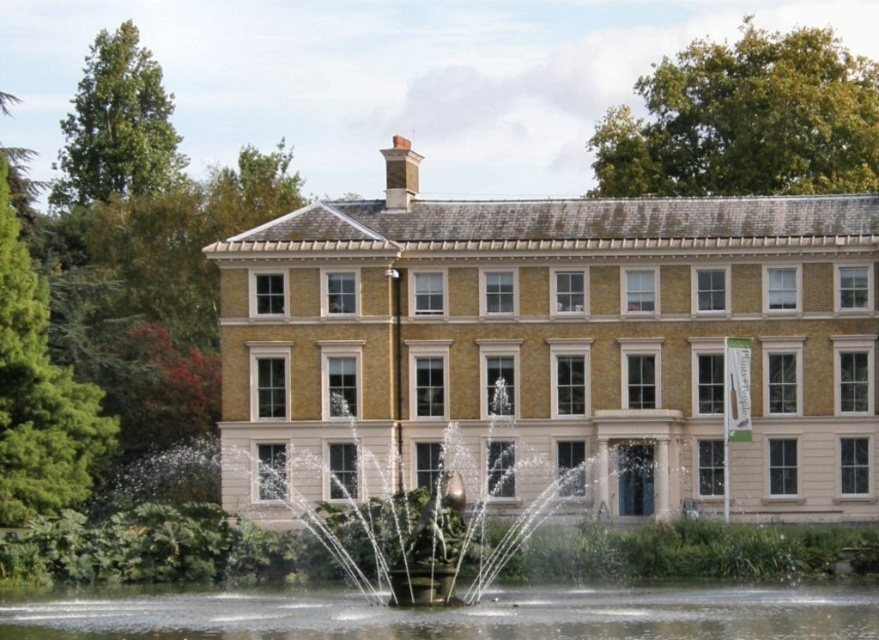
Is clear water at center below bronze fountain at center?

Yes, clear water at center is below bronze fountain at center.

Does clear water at center have a greater width compared to bronze fountain at center?

Yes.

Is point (746, 625) positioned behind point (444, 436)?

No, (746, 625) is in front of (444, 436).

What are the coordinates of `clear water at center` in the screenshot? It's located at (462, 614).

Where is `beige stone mansion at center`? This screenshot has width=879, height=640. beige stone mansion at center is located at coordinates (551, 348).

Does beige stone mansion at center lie in front of clear water at center?

No, it is not.

Is point (519, 381) more distant than point (431, 624)?

Yes, point (519, 381) is farther from viewer.

The width and height of the screenshot is (879, 640). I want to click on beige stone mansion at center, so click(551, 348).

Is beige stone mansion at center bigger than bronze fountain at center?

Indeed, beige stone mansion at center has a larger size compared to bronze fountain at center.

Can you confirm if beige stone mansion at center is thinner than bronze fountain at center?

In fact, beige stone mansion at center might be wider than bronze fountain at center.

Does point (628, 465) lie in front of point (534, 508)?

Yes, it is in front of point (534, 508).

This screenshot has width=879, height=640. Find the location of `beige stone mansion at center`. beige stone mansion at center is located at coordinates (551, 348).